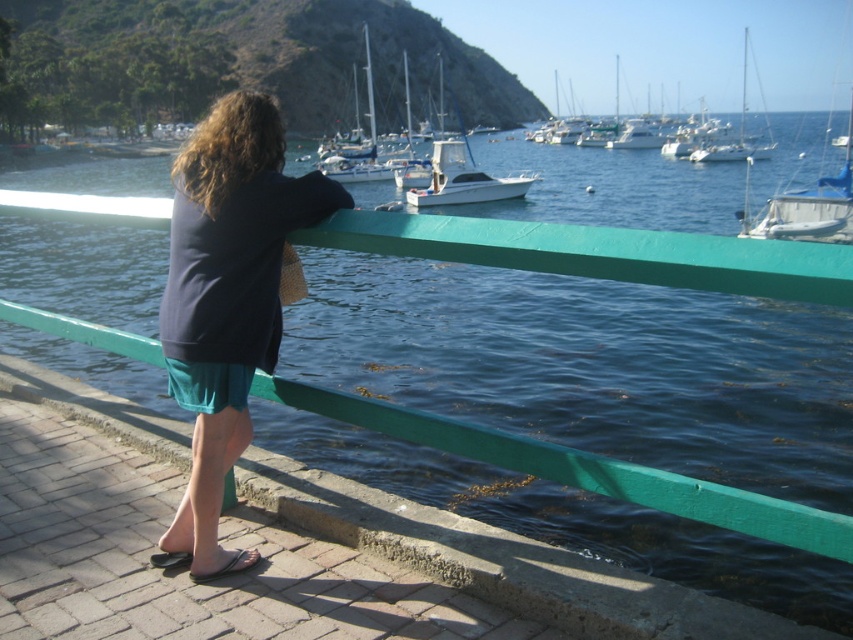
You are a photographer trying to capture the person in the scene. You notice the dark blue sweater at center and the brown leather sandal at lower left. Which object should you focus on to ensure it fills more of your camera frame?

The dark blue sweater at center is larger in size than the brown leather sandal at lower left, so focusing on the dark blue sweater at center will fill more of the camera frame.

You are taking a photo of the waterfront scene and want to focus on both the person and the distant water. Which point, point (323, 145) or point (242, 572), is closer to the camera?

Point (323, 145) is further to the camera than point (242, 572), so the point closer to the camera is point (242, 572).

Based on the scene description, where is the white glossy sailboat at center located in terms of its 2D coordinates?

The white glossy sailboat at center is located at the 2D coordinates of point (367,141).